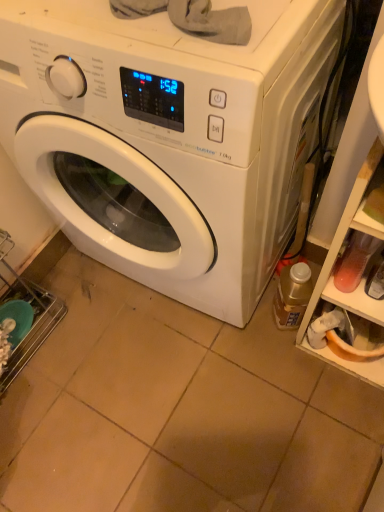
At what (x,y) coordinates should I click in order to perform the action: click on free location to the left of translucent plastic shelf at right. Please return your answer as a coordinate pair (x, y). The width and height of the screenshot is (384, 512). Looking at the image, I should click on (275, 365).